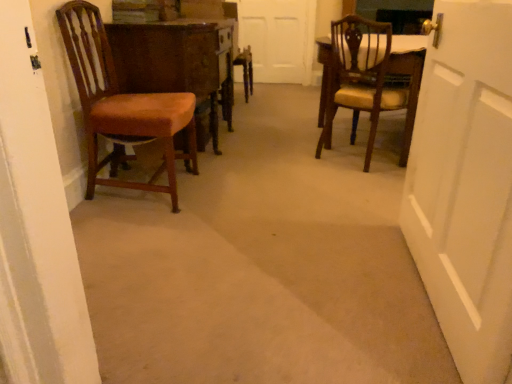
Question: Is matte brown chair at right, which is the second chair from left to right, situated inside white matte door at center or outside?

Choices:
 (A) outside
 (B) inside

Answer: (A)

Question: Considering the positions of matte brown chair at right, which is the second chair from left to right, and white matte door at center in the image, is matte brown chair at right, which is the second chair from left to right, taller or shorter than white matte door at center?

Choices:
 (A) tall
 (B) short

Answer: (B)

Question: Estimate the real-world distances between objects in this image. Which object is closer to the matte brown chair at right, the 1th chair when ordered from right to left?

Choices:
 (A) white matte door at center
 (B) wooden polished table at left
 (C) matte brown chair at left, which ranks as the 1th chair in left-to-right order

Answer: (B)

Question: Which object is positioned closest to the matte brown chair at right, the 1th chair when ordered from right to left?

Choices:
 (A) white matte door at center
 (B) wooden polished table at left
 (C) matte brown chair at left, the 2th chair when ordered from right to left

Answer: (B)